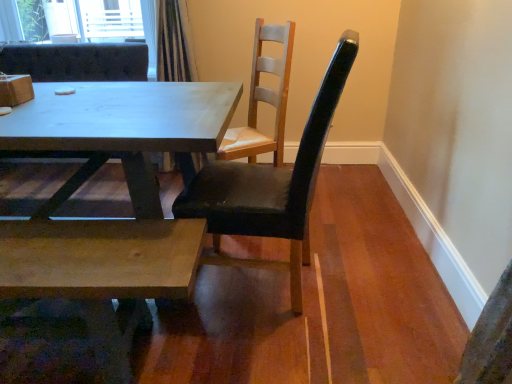
Question: Which direction should I rotate to look at black leather chair at center, acting as the 3th chair starting from the left?

Choices:
 (A) left
 (B) right

Answer: (B)

Question: From the image's perspective, is matte wood table at center located beneath natural wood coffee table at lower left?

Choices:
 (A) no
 (B) yes

Answer: (A)

Question: Can you confirm if matte wood table at center is thinner than natural wood coffee table at lower left?

Choices:
 (A) yes
 (B) no

Answer: (B)

Question: Is matte wood table at center in front of natural wood coffee table at lower left?

Choices:
 (A) no
 (B) yes

Answer: (A)

Question: Does matte wood table at center have a larger size compared to natural wood coffee table at lower left?

Choices:
 (A) no
 (B) yes

Answer: (B)

Question: Would you say matte wood table at center is outside natural wood coffee table at lower left?

Choices:
 (A) yes
 (B) no

Answer: (A)

Question: From a real-world perspective, does matte wood table at center sit lower than natural wood coffee table at lower left?

Choices:
 (A) no
 (B) yes

Answer: (A)

Question: Is matte white chair at center, placed as the 1th chair when sorted from left to right, not close to matte wood table at center?

Choices:
 (A) no
 (B) yes

Answer: (A)

Question: Does matte white chair at center, placed as the 1th chair when sorted from left to right, have a lesser width compared to matte wood table at center?

Choices:
 (A) yes
 (B) no

Answer: (A)

Question: Does matte white chair at center, arranged as the third chair when viewed from the right, lie in front of matte wood table at center?

Choices:
 (A) no
 (B) yes

Answer: (A)

Question: Does matte white chair at center, placed as the 1th chair when sorted from left to right, turn towards matte wood table at center?

Choices:
 (A) no
 (B) yes

Answer: (B)

Question: Is matte white chair at center, placed as the 1th chair when sorted from left to right, shorter than matte wood table at center?

Choices:
 (A) yes
 (B) no

Answer: (B)

Question: Is matte wood table at center located within matte white chair at center, arranged as the third chair when viewed from the right?

Choices:
 (A) yes
 (B) no

Answer: (B)

Question: Does black leather chair at center, the first chair viewed from the right, have a smaller size compared to matte white chair at center, placed as the 1th chair when sorted from left to right?

Choices:
 (A) no
 (B) yes

Answer: (B)